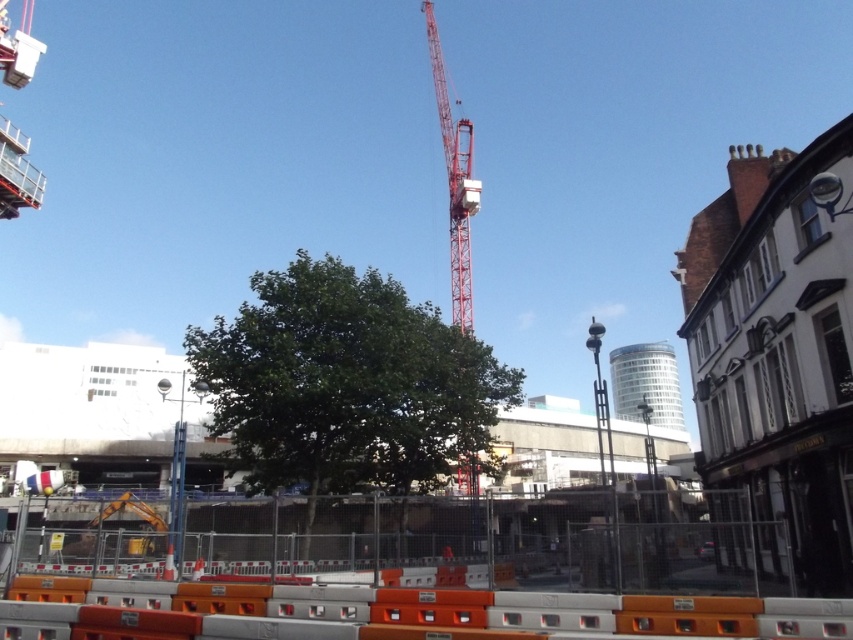
Question: Which object is positioned closest to the green leafy tree at center?

Choices:
 (A) red metallic crane at center
 (B) orange concrete barriers at center

Answer: (B)

Question: Which object is closer to the camera taking this photo?

Choices:
 (A) green leafy tree at center
 (B) orange concrete barriers at center

Answer: (B)

Question: Is orange concrete barriers at center further to the viewer compared to red metallic crane at center?

Choices:
 (A) yes
 (B) no

Answer: (B)

Question: Can you confirm if green leafy tree at center is wider than red metallic crane at center?

Choices:
 (A) yes
 (B) no

Answer: (A)

Question: Which point is closer to the camera?

Choices:
 (A) (368, 413)
 (B) (421, 572)
 (C) (440, 74)

Answer: (B)

Question: Does orange concrete barriers at center have a greater width compared to red metallic crane at center?

Choices:
 (A) yes
 (B) no

Answer: (A)